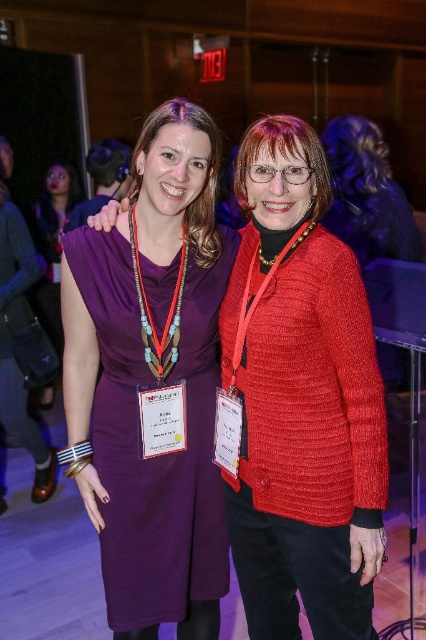
Question: Does knitted red sweater at center appear over matte purple dress at center?

Choices:
 (A) yes
 (B) no

Answer: (B)

Question: Can you confirm if knitted red sweater at center is bigger than matte purple dress at center?

Choices:
 (A) no
 (B) yes

Answer: (A)

Question: Among these points, which one is farthest from the camera?

Choices:
 (A) (x=333, y=570)
 (B) (x=135, y=408)

Answer: (B)

Question: Which object is farther from the camera taking this photo?

Choices:
 (A) matte purple dress at center
 (B) knitted red sweater at center

Answer: (A)

Question: Is knitted red sweater at center further to the viewer compared to matte purple dress at center?

Choices:
 (A) yes
 (B) no

Answer: (B)